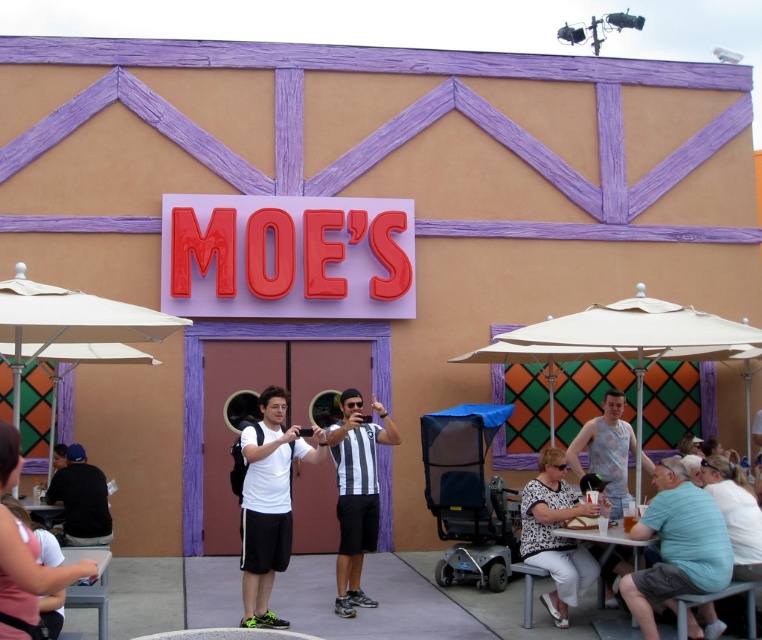
Which of these two, white matte t-shirt at center or black shirt at lower left, stands taller?

white matte t-shirt at center is taller.

The width and height of the screenshot is (762, 640). I want to click on white matte t-shirt at center, so point(269,500).

This screenshot has height=640, width=762. I want to click on white matte t-shirt at center, so click(x=269, y=500).

Where is `light blue t-shirt at lower right`? The image size is (762, 640). light blue t-shirt at lower right is located at coordinates (677, 545).

Between light blue t-shirt at lower right and dark blue shirt at lower left, which one is positioned lower?

light blue t-shirt at lower right is lower down.

The width and height of the screenshot is (762, 640). Identify the location of light blue t-shirt at lower right. (677, 545).

Between white matte t-shirt at center and striped jersey at center, which one is positioned lower?

striped jersey at center is below.

From the picture: Can you confirm if white matte t-shirt at center is positioned above striped jersey at center?

Correct, white matte t-shirt at center is located above striped jersey at center.

Is point (255, 625) farther from viewer compared to point (341, 493)?

No, (255, 625) is closer to viewer.

This screenshot has height=640, width=762. I want to click on white matte t-shirt at center, so [269, 500].